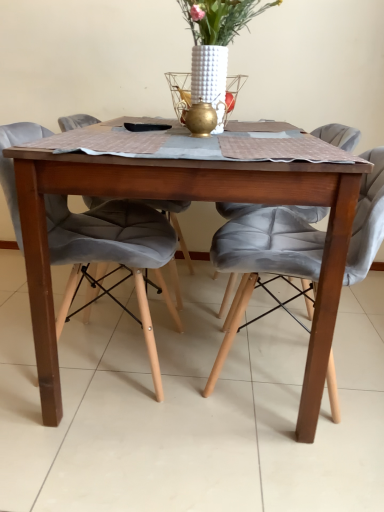
Question: Is velvet grey chair at center, which is counted as the first chair, starting from the left, bigger than wooden table at center?

Choices:
 (A) yes
 (B) no

Answer: (B)

Question: From a real-world perspective, is velvet grey chair at center, which is counted as the first chair, starting from the left, on top of wooden table at center?

Choices:
 (A) yes
 (B) no

Answer: (A)

Question: Is velvet grey chair at center, which is counted as the first chair, starting from the left, positioned before wooden table at center?

Choices:
 (A) no
 (B) yes

Answer: (A)

Question: Does velvet grey chair at center, which is counted as the first chair, starting from the left, have a greater height compared to wooden table at center?

Choices:
 (A) yes
 (B) no

Answer: (A)

Question: Is wooden table at center at the back of velvet grey chair at center, which is counted as the first chair, starting from the left?

Choices:
 (A) no
 (B) yes

Answer: (B)

Question: Is velvet grey chair at center, which is counted as the first chair, starting from the left, smaller than wooden table at center?

Choices:
 (A) yes
 (B) no

Answer: (A)

Question: Is white textured vase at center to the left of velvet grey chair at center, the second chair positioned from the right, from the viewer's perspective?

Choices:
 (A) yes
 (B) no

Answer: (B)

Question: Is there a large distance between white textured vase at center and velvet grey chair at center, which is counted as the first chair, starting from the left?

Choices:
 (A) yes
 (B) no

Answer: (B)

Question: Does white textured vase at center have a greater width compared to velvet grey chair at center, the second chair positioned from the right?

Choices:
 (A) yes
 (B) no

Answer: (B)

Question: Is the depth of white textured vase at center greater than that of velvet grey chair at center, the second chair positioned from the right?

Choices:
 (A) no
 (B) yes

Answer: (B)

Question: Is white textured vase at center looking in the opposite direction of velvet grey chair at center, the second chair positioned from the right?

Choices:
 (A) yes
 (B) no

Answer: (B)

Question: Is white textured vase at center thinner than velvet grey chair at center, the second chair positioned from the right?

Choices:
 (A) no
 (B) yes

Answer: (B)

Question: Is wooden table at center located outside white textured vase at center?

Choices:
 (A) no
 (B) yes

Answer: (B)